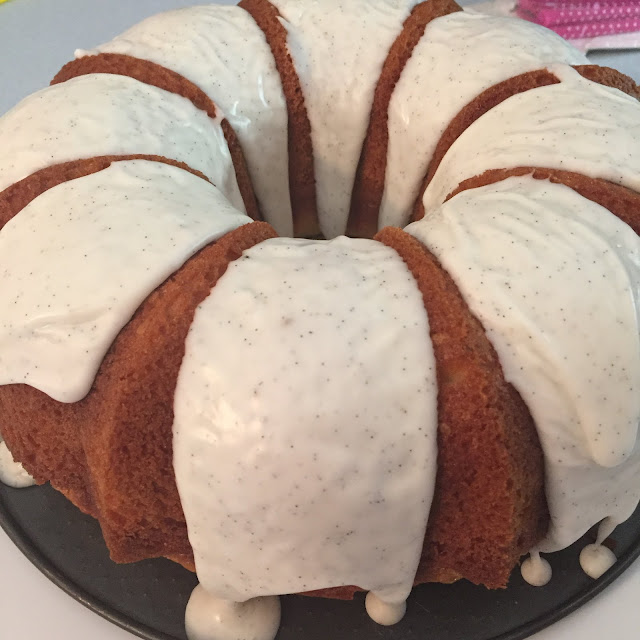
What are the coordinates of `folded fabric` in the screenshot? It's located at (598, 10).